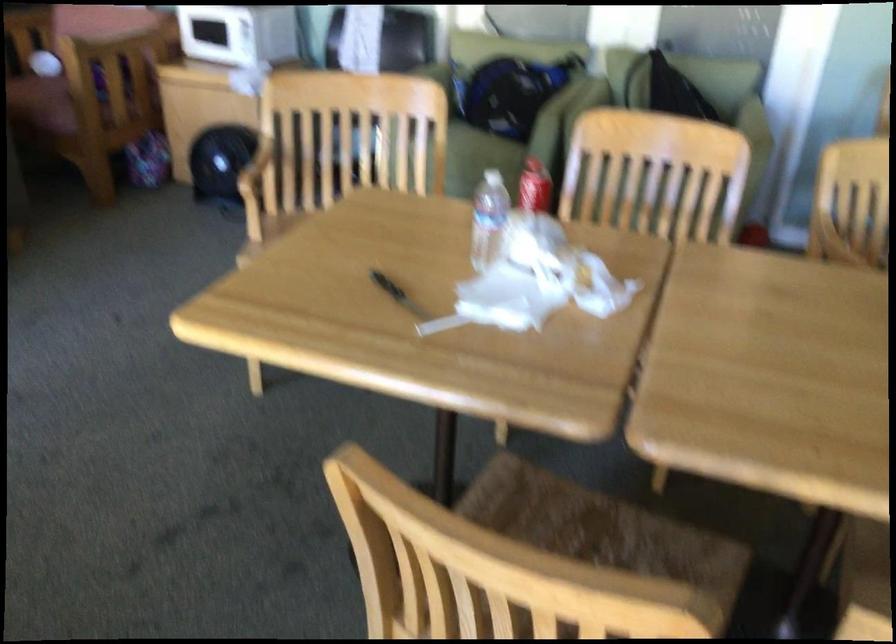
This screenshot has width=896, height=644. What are the coordinates of `sofa sitting surface` in the screenshot? It's located at (479, 160).